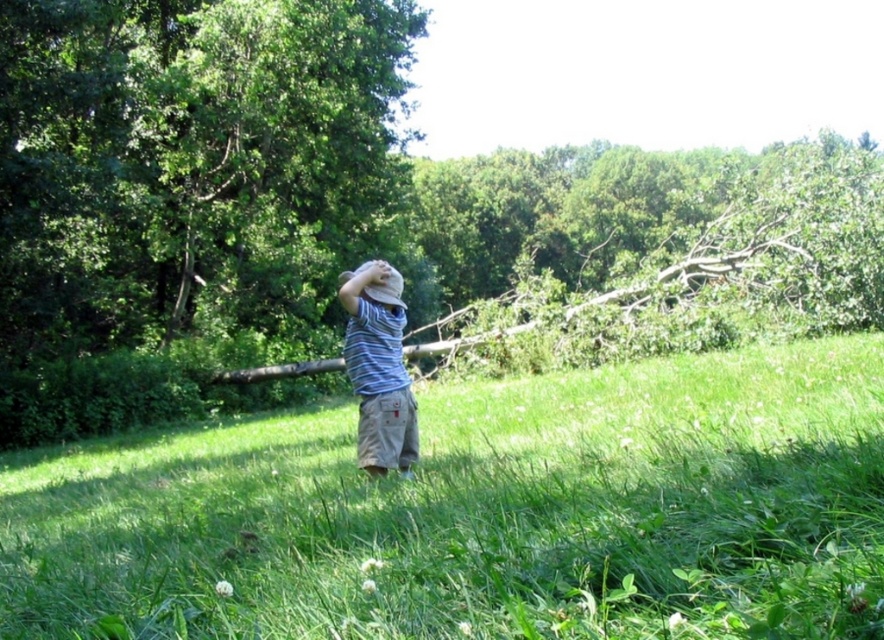
Question: Is brown wood log at center thinner than striped cotton shirt at center?

Choices:
 (A) yes
 (B) no

Answer: (B)

Question: Based on their relative distances, which object is nearer to the brown wood log at center?

Choices:
 (A) striped cotton shirt at center
 (B) green grassy at center

Answer: (A)

Question: Is green grassy at center to the right of brown wood log at center from the viewer's perspective?

Choices:
 (A) no
 (B) yes

Answer: (A)

Question: Which point is closer to the camera?

Choices:
 (A) green grassy at center
 (B) brown wood log at center

Answer: (A)

Question: Does green grassy at center come behind brown wood log at center?

Choices:
 (A) no
 (B) yes

Answer: (A)

Question: Which point appears closest to the camera in this image?

Choices:
 (A) coord(387,428)
 (B) coord(195,80)

Answer: (A)